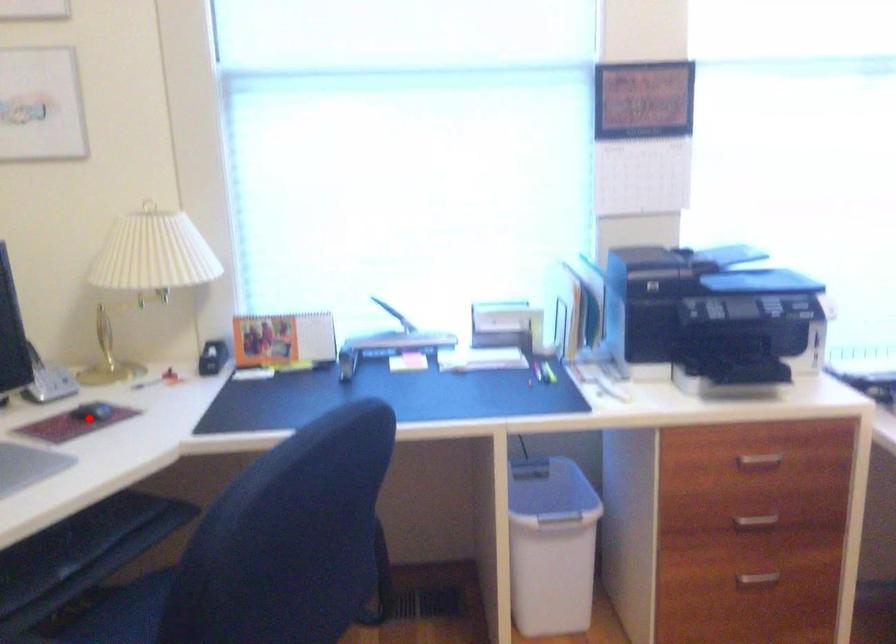
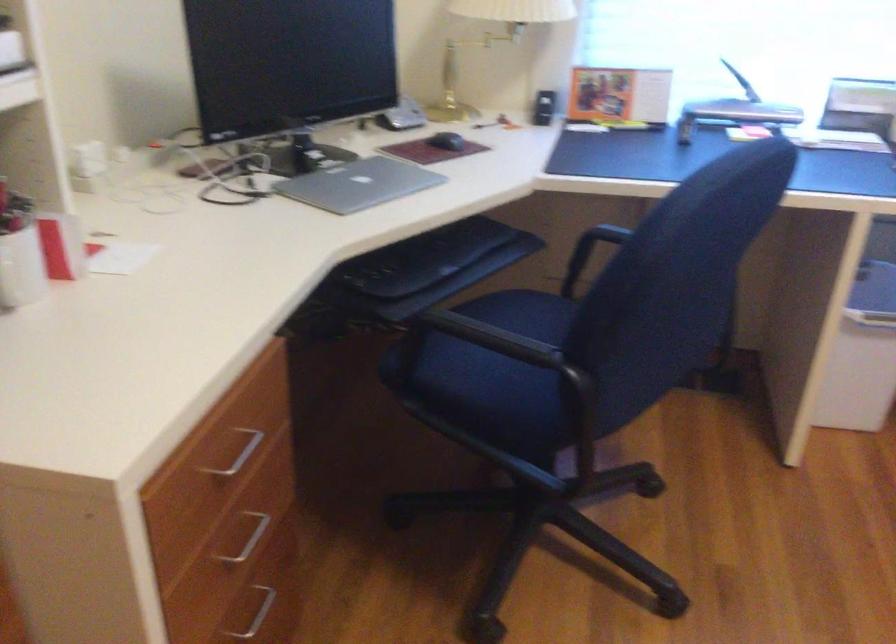
Where in the second image is the point corresponding to the highlighted location from the first image?

(446, 140)